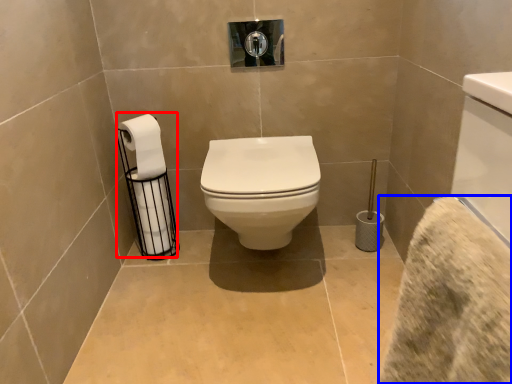
Question: Which point is closer to the camera, toilet paper (highlighted by a red box) or bath towel (highlighted by a blue box)?

Choices:
 (A) toilet paper
 (B) bath towel

Answer: (B)